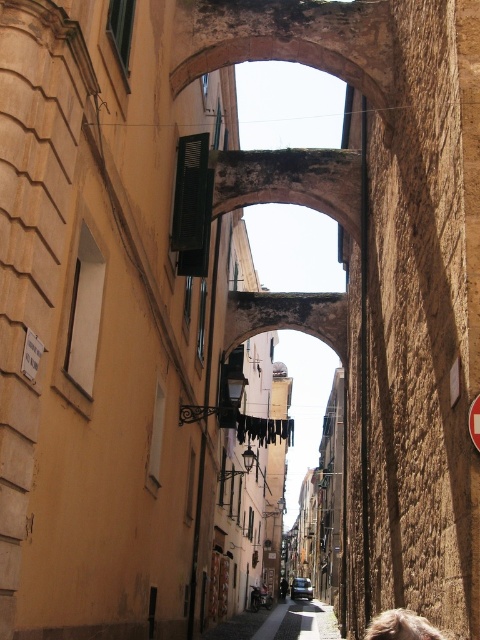
You are a delivery person carrying a large package that is 1.8 meters wide. You are in the middle of the smooth stone alley at center and see the dark brown leather jacket at center lying on the ground. Can your package fit through the alley without touching the jacket?

The smooth stone alley at center is larger in size than the dark brown leather jacket at center, so the package can fit through the alley as long as it avoids the jacket.

You are a delivery person carrying a package that is 1.2 meters wide. You are in the alleyway and see the black fabric laundry at center and the dark brown leather jacket at center hanging from the same clothesline. Can your package fit between them?

The black fabric laundry at center is larger in size than dark brown leather jacket at center, so the space between them may be sufficient to fit your 1.2 meter wide package. However, the exact dimensions are not provided, so it depends on how much space the larger laundry item occupies.

You are a delivery person carrying a package that is 2 meters long. You are standing in the alleyway and see the black fabric laundry at center and the dark brown leather jacket at center. Can you pass through the space between them without bending the package?

The black fabric laundry at center is 118.37 meters from dark brown leather jacket at center. Since the distance between them is much larger than the package length, you can pass through the space between them without bending the package.